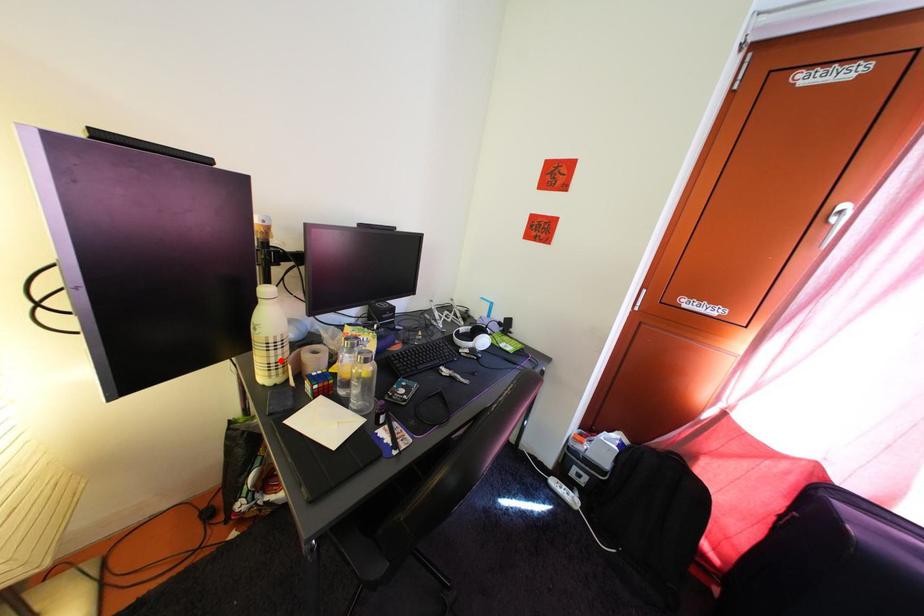
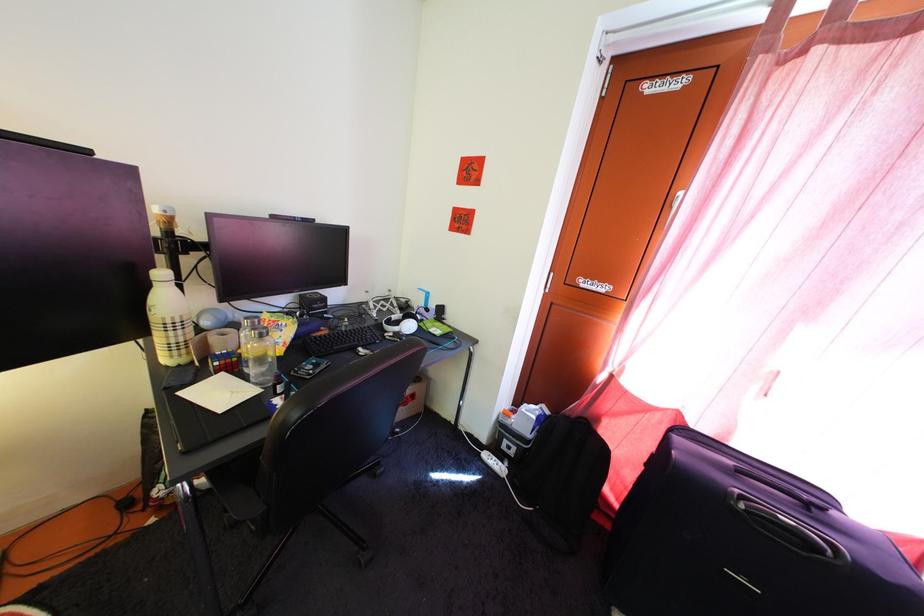
Where in the second image is the point corresponding to the highlighted location from the first image?

(179, 341)